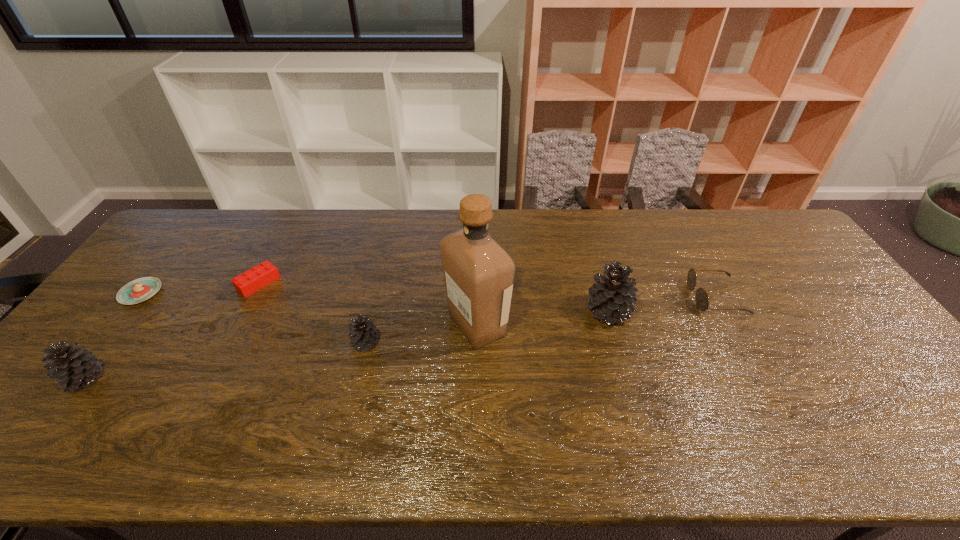
The pinecones are evenly distributed in the image. To maintain this, where would you place another pinecone on the right? Please point to a free space. Please provide its 2D coordinates. Your answer should be formatted as a tuple, i.e. [(x, y)], where the tuple contains the x and y coordinates of a point satisfying the conditions above.

[(822, 285)]